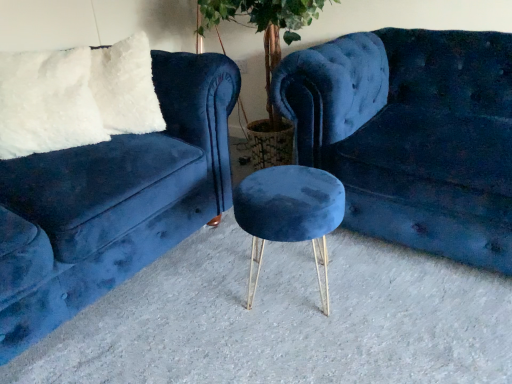
Locate an element on the screen. The height and width of the screenshot is (384, 512). velvet blue couch at left, the first studio couch when ordered from left to right is located at coordinates pos(113,201).

Locate an element on the screen. This screenshot has width=512, height=384. white fluffy pillow at upper left is located at coordinates (47, 103).

What do you see at coordinates (290, 214) in the screenshot? The height and width of the screenshot is (384, 512). I see `velvet blue stool at center` at bounding box center [290, 214].

Measure the distance between point (290, 198) and camera.

Point (290, 198) and camera are 1.21 meters apart from each other.

At what (x,y) coordinates should I click in order to perform the action: click on velvet blue couch at left, the second studio couch when ordered from right to left. Please return your answer as a coordinate pair (x, y). The height and width of the screenshot is (384, 512). Looking at the image, I should click on (113, 201).

Between point (47, 59) and point (315, 226), which one is positioned in front?

The point (315, 226) is in front.

Consider the image. From a real-world perspective, is white fluffy pillow at upper left physically located above or below velvet blue stool at center?

white fluffy pillow at upper left is situated higher than velvet blue stool at center in the real world.

Measure the distance between white fluffy pillow at upper left and velvet blue stool at center.

white fluffy pillow at upper left and velvet blue stool at center are 28.99 inches apart.

Which object is wider, white fluffy pillow at upper left or velvet blue stool at center?

With larger width is velvet blue stool at center.

This screenshot has width=512, height=384. I want to click on studio couch to the right of velvet blue stool at center, so pos(411,135).

Is velvet blue couch at center, placed as the 2th studio couch when sorted from left to right, wider than velvet blue stool at center?

Yes, velvet blue couch at center, placed as the 2th studio couch when sorted from left to right, is wider than velvet blue stool at center.

How many degrees apart are the facing directions of velvet blue couch at center, placed as the 2th studio couch when sorted from left to right, and velvet blue stool at center?

4.61 degrees.

Can you confirm if velvet blue couch at center, placed as the 2th studio couch when sorted from left to right, is bigger than velvet blue stool at center?

Correct, velvet blue couch at center, placed as the 2th studio couch when sorted from left to right, is larger in size than velvet blue stool at center.

Is velvet blue couch at left, the first studio couch when ordered from left to right, wider than velvet blue stool at center?

Indeed, velvet blue couch at left, the first studio couch when ordered from left to right, has a greater width compared to velvet blue stool at center.

Does point (49, 289) appear closer or farther from the camera than point (312, 233)?

Point (49, 289) is positioned farther from the camera compared to point (312, 233).

How much distance is there between velvet blue couch at left, the first studio couch when ordered from left to right, and velvet blue stool at center?

16.70 inches.

Considering the positions of objects velvet blue couch at left, the first studio couch when ordered from left to right, and velvet blue stool at center in the image provided, who is in front, velvet blue couch at left, the first studio couch when ordered from left to right, or velvet blue stool at center?

velvet blue couch at left, the first studio couch when ordered from left to right, is closer to the camera.

Which is more distant, (349, 104) or (58, 287)?

Positioned behind is point (349, 104).

What's the angular difference between velvet blue couch at center, arranged as the first studio couch when viewed from the right, and velvet blue couch at left, the second studio couch when ordered from right to left,'s facing directions?

The facing directions of velvet blue couch at center, arranged as the first studio couch when viewed from the right, and velvet blue couch at left, the second studio couch when ordered from right to left, are 88.7 degrees apart.

Is velvet blue couch at center, placed as the 2th studio couch when sorted from left to right, turned away from velvet blue couch at left, the second studio couch when ordered from right to left?

No, velvet blue couch at center, placed as the 2th studio couch when sorted from left to right, is not facing away from velvet blue couch at left, the second studio couch when ordered from right to left.

Are velvet blue couch at center, arranged as the first studio couch when viewed from the right, and velvet blue couch at left, the first studio couch when ordered from left to right, making contact?

velvet blue couch at center, arranged as the first studio couch when viewed from the right, and velvet blue couch at left, the first studio couch when ordered from left to right, are not in contact.

How different are the orientations of velvet blue stool at center and velvet blue couch at center, placed as the 2th studio couch when sorted from left to right, in degrees?

4.61 degrees.

From the image's perspective, is velvet blue stool at center positioned above or below velvet blue couch at center, placed as the 2th studio couch when sorted from left to right?

From the image's perspective, velvet blue stool at center appears below velvet blue couch at center, placed as the 2th studio couch when sorted from left to right.

Between velvet blue stool at center and velvet blue couch at center, arranged as the first studio couch when viewed from the right, which one appears on the left side from the viewer's perspective?

Positioned to the left is velvet blue stool at center.

Considering the positions of points (255, 194) and (442, 167), is point (255, 194) closer to camera compared to point (442, 167)?

Yes, point (255, 194) is in front of point (442, 167).

Which object is positioned more to the right, velvet blue couch at center, arranged as the first studio couch when viewed from the right, or white fluffy pillow at upper left?

velvet blue couch at center, arranged as the first studio couch when viewed from the right.

Considering the sizes of velvet blue couch at center, arranged as the first studio couch when viewed from the right, and white fluffy pillow at upper left in the image, is velvet blue couch at center, arranged as the first studio couch when viewed from the right, wider or thinner than white fluffy pillow at upper left?

Clearly, velvet blue couch at center, arranged as the first studio couch when viewed from the right, has more width compared to white fluffy pillow at upper left.

Between velvet blue couch at center, arranged as the first studio couch when viewed from the right, and white fluffy pillow at upper left, which one has more height?

velvet blue couch at center, arranged as the first studio couch when viewed from the right.

How many degrees apart are the facing directions of velvet blue couch at left, the second studio couch when ordered from right to left, and velvet blue couch at center, arranged as the first studio couch when viewed from the right?

88.7 degrees separate the facing orientations of velvet blue couch at left, the second studio couch when ordered from right to left, and velvet blue couch at center, arranged as the first studio couch when viewed from the right.

From the image's perspective, does velvet blue couch at left, the first studio couch when ordered from left to right, appear lower than velvet blue couch at center, placed as the 2th studio couch when sorted from left to right?

Yes, from the image's perspective, velvet blue couch at left, the first studio couch when ordered from left to right, is below velvet blue couch at center, placed as the 2th studio couch when sorted from left to right.

Could you tell me if velvet blue couch at left, the second studio couch when ordered from right to left, is turned towards velvet blue couch at center, placed as the 2th studio couch when sorted from left to right?

No, velvet blue couch at left, the second studio couch when ordered from right to left, is not oriented towards velvet blue couch at center, placed as the 2th studio couch when sorted from left to right.

Looking at this image, would you say velvet blue couch at left, the first studio couch when ordered from left to right, is a long distance from velvet blue couch at center, arranged as the first studio couch when viewed from the right?

Actually, velvet blue couch at left, the first studio couch when ordered from left to right, and velvet blue couch at center, arranged as the first studio couch when viewed from the right, are a little close together.

Image resolution: width=512 pixels, height=384 pixels. Find the location of `bar stool that appears below the white fluffy pillow at upper left (from a real-world perspective)`. bar stool that appears below the white fluffy pillow at upper left (from a real-world perspective) is located at coordinates (290, 214).

I want to click on studio couch that is the 1st one above the velvet blue stool at center (from a real-world perspective), so [x=411, y=135].

Which object lies nearer to the anchor point velvet blue couch at left, the second studio couch when ordered from right to left, white fluffy pillow at upper left or velvet blue couch at center, placed as the 2th studio couch when sorted from left to right?

white fluffy pillow at upper left lies closer to velvet blue couch at left, the second studio couch when ordered from right to left, than the other object.

When comparing their distances from velvet blue stool at center, does white fluffy pillow at upper left or velvet blue couch at center, arranged as the first studio couch when viewed from the right, seem closer?

Based on the image, velvet blue couch at center, arranged as the first studio couch when viewed from the right, appears to be nearer to velvet blue stool at center.

From the image, which object appears to be farther from velvet blue stool at center, velvet blue couch at center, placed as the 2th studio couch when sorted from left to right, or white fluffy pillow at upper left?

white fluffy pillow at upper left.

Consider the image. Considering their positions, is velvet blue stool at center positioned further to velvet blue couch at left, the first studio couch when ordered from left to right, than white fluffy pillow at upper left?

Among the two, velvet blue stool at center is located further to velvet blue couch at left, the first studio couch when ordered from left to right.

Looking at the image, which one is located closer to velvet blue stool at center, velvet blue couch at center, placed as the 2th studio couch when sorted from left to right, or velvet blue couch at left, the second studio couch when ordered from right to left?

velvet blue couch at center, placed as the 2th studio couch when sorted from left to right.

Looking at the image, which one is located closer to velvet blue stool at center, white fluffy pillow at upper left or velvet blue couch at left, the second studio couch when ordered from right to left?

velvet blue couch at left, the second studio couch when ordered from right to left, lies closer to velvet blue stool at center than the other object.

Based on their spatial positions, is velvet blue stool at center or white fluffy pillow at upper left further from velvet blue couch at center, placed as the 2th studio couch when sorted from left to right?

Among the two, white fluffy pillow at upper left is located further to velvet blue couch at center, placed as the 2th studio couch when sorted from left to right.

Which object lies further to the anchor point velvet blue couch at center, arranged as the first studio couch when viewed from the right, velvet blue stool at center or velvet blue couch at left, the second studio couch when ordered from right to left?

velvet blue couch at left, the second studio couch when ordered from right to left.

The image size is (512, 384). I want to click on bar stool situated between velvet blue couch at left, the first studio couch when ordered from left to right, and velvet blue couch at center, placed as the 2th studio couch when sorted from left to right, from left to right, so click(x=290, y=214).

Find the location of a particular element. The width and height of the screenshot is (512, 384). bar stool located between white fluffy pillow at upper left and velvet blue couch at center, arranged as the first studio couch when viewed from the right, in the left-right direction is located at coordinates (290, 214).

Where is `studio couch situated between white fluffy pillow at upper left and velvet blue stool at center from left to right`? The height and width of the screenshot is (384, 512). studio couch situated between white fluffy pillow at upper left and velvet blue stool at center from left to right is located at coordinates (113, 201).

The image size is (512, 384). Identify the location of studio couch situated between white fluffy pillow at upper left and velvet blue couch at center, placed as the 2th studio couch when sorted from left to right, from left to right. (113, 201).